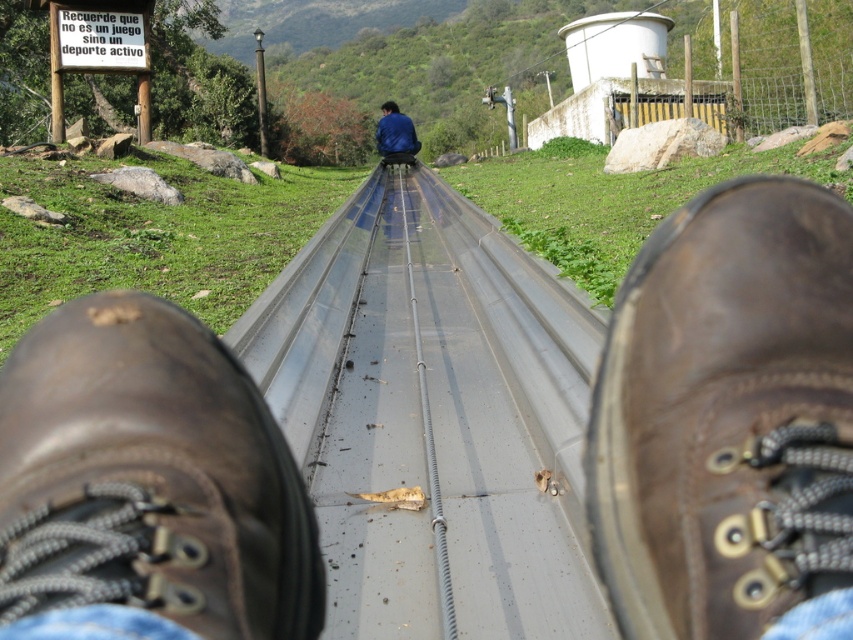
Is metallic smooth train track at center wider than blue fabric jacket at center?

Yes, metallic smooth train track at center is wider than blue fabric jacket at center.

Does metallic smooth train track at center have a lesser height compared to blue fabric jacket at center?

Correct, metallic smooth train track at center is not as tall as blue fabric jacket at center.

Is point (428, 515) more distant than point (376, 144)?

That is False.

Locate an element on the screen. This screenshot has width=853, height=640. metallic smooth train track at center is located at coordinates (434, 417).

Who is taller, brown leather boot at lower center or blue fabric jacket at center?

Standing taller between the two is blue fabric jacket at center.

Does brown leather boot at lower center appear over blue fabric jacket at center?

No.

I want to click on brown leather boot at lower center, so click(726, 413).

Who is taller, brown leather boot at center or blue fabric jacket at center?

blue fabric jacket at center is taller.

Does brown leather boot at center have a lesser height compared to blue fabric jacket at center?

Indeed, brown leather boot at center has a lesser height compared to blue fabric jacket at center.

Between point (32, 340) and point (401, 132), which one is positioned in front?

Point (32, 340) is more forward.

The height and width of the screenshot is (640, 853). In order to click on brown leather boot at center in this screenshot , I will do `click(149, 476)`.